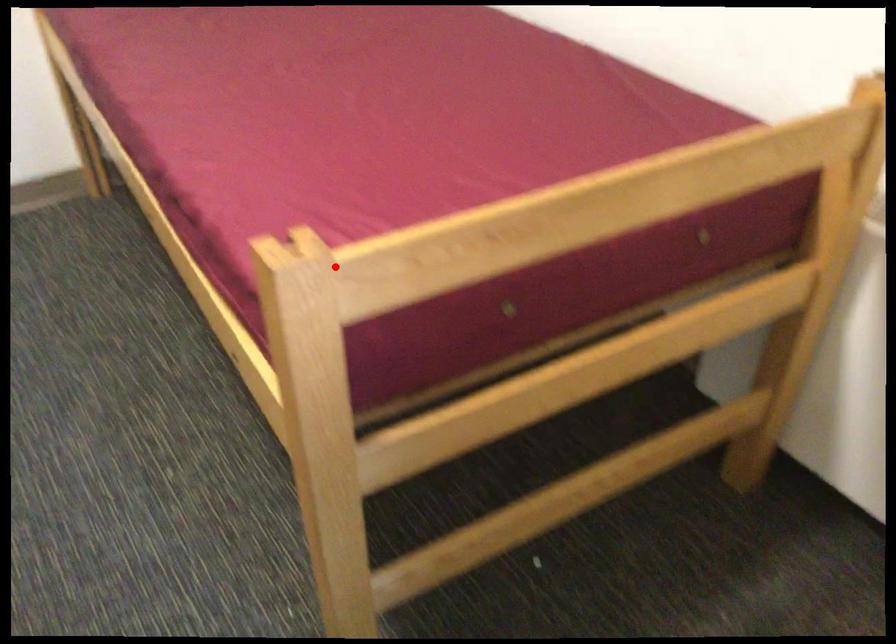
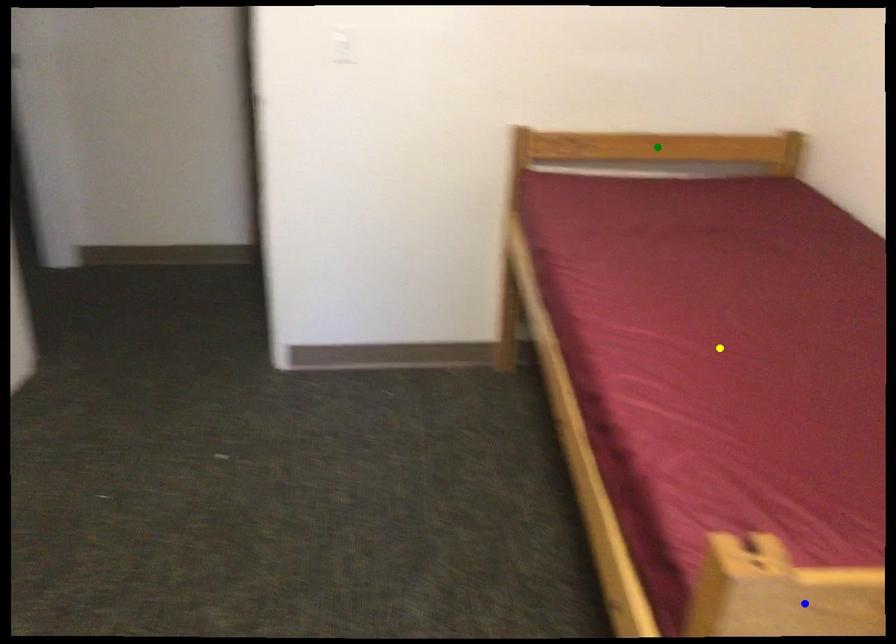
Question: I am providing you with two images of the same scene from different viewpoints. A red point is marked on the first image. You are given multiple points on the second image. Which point in image 2 represents the same 3d spot as the red point in image 1?

Choices:
 (A) yellow point
 (B) green point
 (C) blue point

Answer: (C)